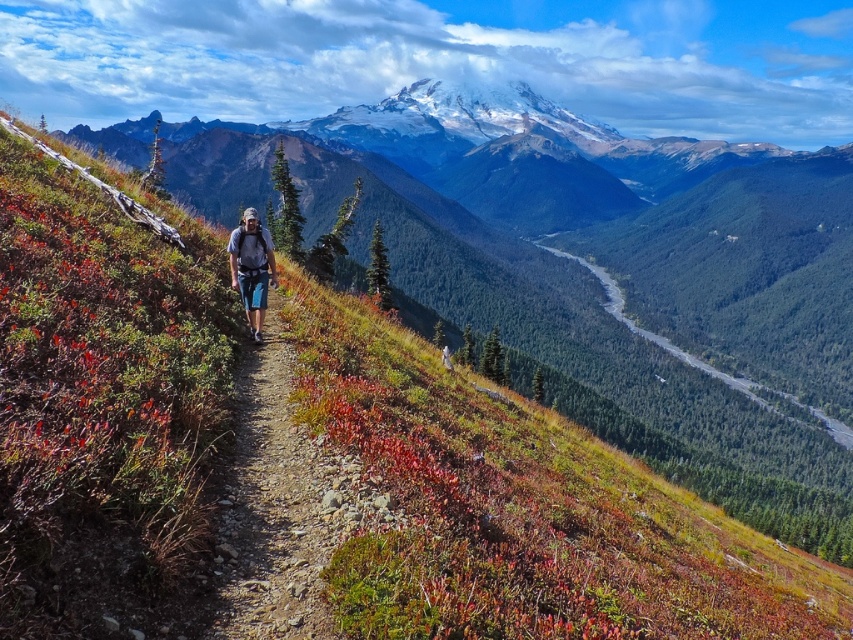
Question: Is matte blue jeans at center below green forested valley at center?

Choices:
 (A) no
 (B) yes

Answer: (B)

Question: Which of the following is the farthest from the observer?

Choices:
 (A) (267, 273)
 (B) (611, 307)

Answer: (B)

Question: Which of these objects is positioned farthest from the dirt path at center?

Choices:
 (A) matte blue jeans at center
 (B) green forested valley at center

Answer: (B)

Question: Is dirt path at center positioned behind matte blue jeans at center?

Choices:
 (A) yes
 (B) no

Answer: (B)

Question: Which point appears farthest from the camera in this image?

Choices:
 (A) (599, 272)
 (B) (241, 266)

Answer: (A)

Question: Does matte blue jeans at center come behind green forested valley at center?

Choices:
 (A) no
 (B) yes

Answer: (A)